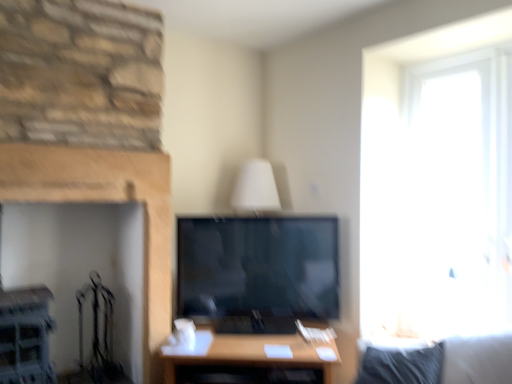
Question: Does smooth stone fireplace at left come behind wooden table at center?

Choices:
 (A) no
 (B) yes

Answer: (A)

Question: Is smooth stone fireplace at left closer to the viewer compared to wooden table at center?

Choices:
 (A) yes
 (B) no

Answer: (A)

Question: Considering the relative sizes of smooth stone fireplace at left and wooden table at center in the image provided, is smooth stone fireplace at left bigger than wooden table at center?

Choices:
 (A) no
 (B) yes

Answer: (A)

Question: Considering the relative positions of smooth stone fireplace at left and wooden table at center in the image provided, is smooth stone fireplace at left to the right of wooden table at center from the viewer's perspective?

Choices:
 (A) yes
 (B) no

Answer: (B)

Question: Is smooth stone fireplace at left at the left side of wooden table at center?

Choices:
 (A) no
 (B) yes

Answer: (B)

Question: Can wooden table at center be found inside smooth stone fireplace at left?

Choices:
 (A) no
 (B) yes

Answer: (A)

Question: Can you confirm if wooden table at center is thinner than smooth stone fireplace at left?

Choices:
 (A) no
 (B) yes

Answer: (A)

Question: Is wooden table at center not within smooth stone fireplace at left?

Choices:
 (A) yes
 (B) no

Answer: (A)

Question: Could you tell me if wooden table at center is turned towards smooth stone fireplace at left?

Choices:
 (A) yes
 (B) no

Answer: (B)

Question: Considering the relative sizes of wooden table at center and smooth stone fireplace at left in the image provided, is wooden table at center wider than smooth stone fireplace at left?

Choices:
 (A) yes
 (B) no

Answer: (A)

Question: From a real-world perspective, is wooden table at center below smooth stone fireplace at left?

Choices:
 (A) yes
 (B) no

Answer: (A)

Question: Can you confirm if wooden table at center is smaller than smooth stone fireplace at left?

Choices:
 (A) no
 (B) yes

Answer: (A)

Question: From the image's perspective, relative to smooth stone fireplace at left, is wooden table at center above or below?

Choices:
 (A) above
 (B) below

Answer: (B)